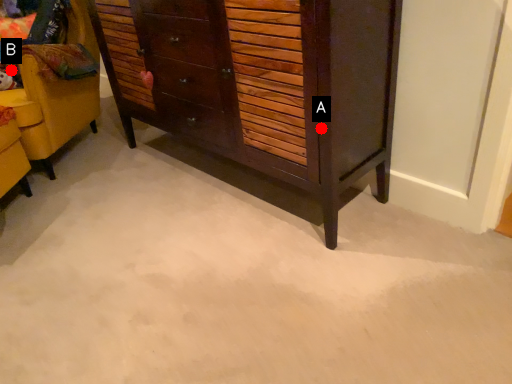
Question: Two points are circled on the image, labeled by A and B beside each circle. Which point is closer to the camera?

Choices:
 (A) A is closer
 (B) B is closer

Answer: (A)